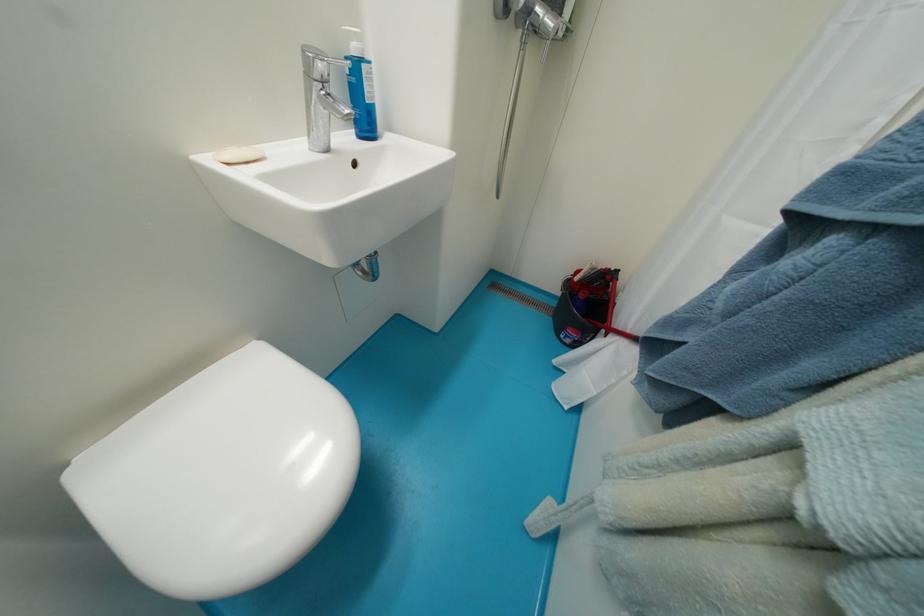
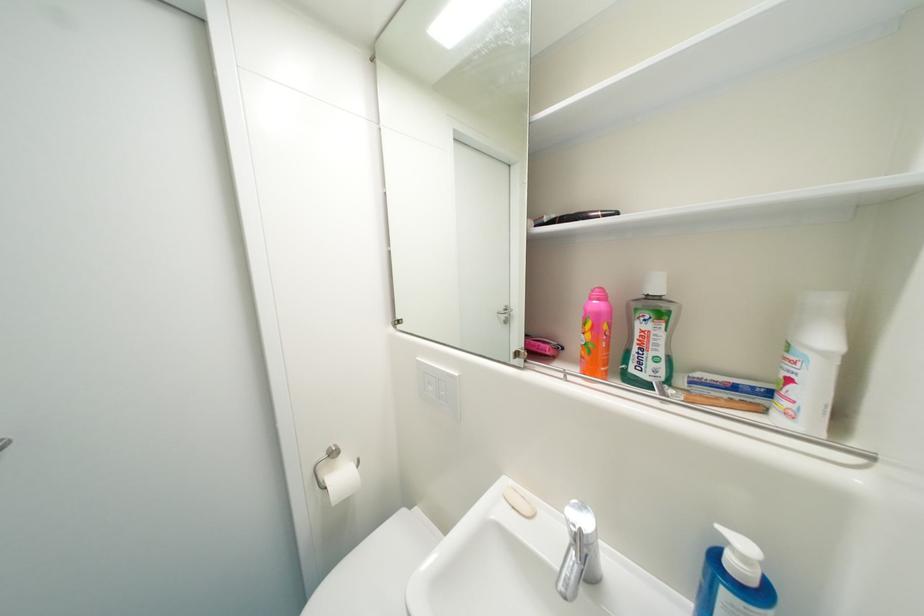
Question: How did the camera likely rotate?

Choices:
 (A) Left
 (B) Right
 (C) Up
 (D) Down

Answer: (A)